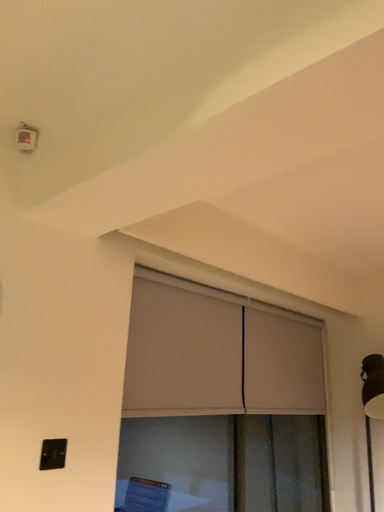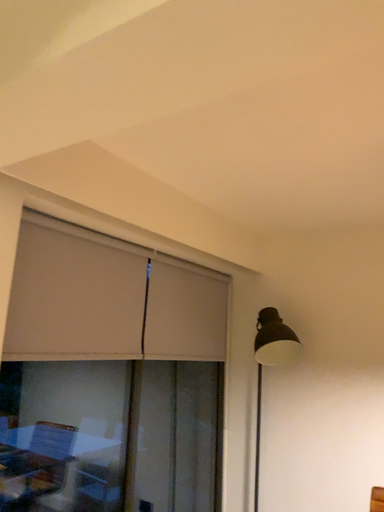
Question: How did the camera likely rotate when shooting the video?

Choices:
 (A) rotated right
 (B) rotated left

Answer: (A)